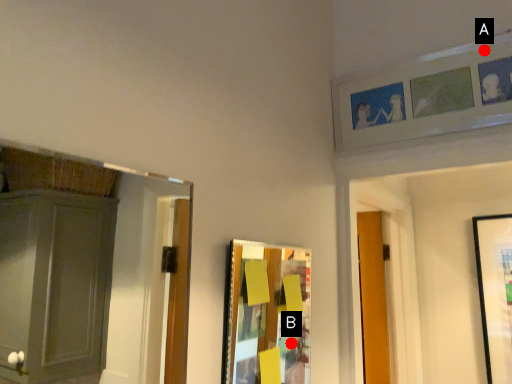
Question: Two points are circled on the image, labeled by A and B beside each circle. Which point is farther to the camera?

Choices:
 (A) A is further
 (B) B is further

Answer: (A)